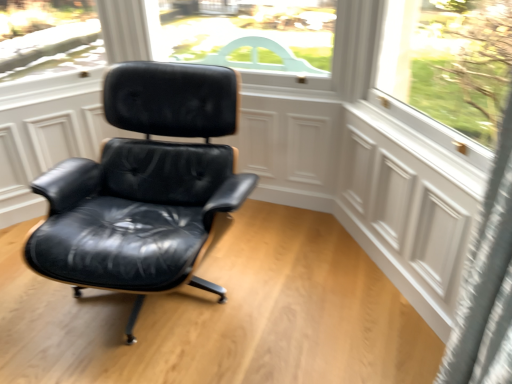
Measure the distance between white matte screen door at right and camera.

They are 1.29 meters apart.

In order to face white matte screen door at right, should I rotate leftwards or rightwards?

To align with it, rotate right about 18.075°.

The image size is (512, 384). I want to click on white matte screen door at right, so click(x=410, y=200).

The height and width of the screenshot is (384, 512). What do you see at coordinates (410, 200) in the screenshot?
I see `white matte screen door at right` at bounding box center [410, 200].

What do you see at coordinates (145, 186) in the screenshot? Image resolution: width=512 pixels, height=384 pixels. I see `black leather chair at center` at bounding box center [145, 186].

Identify the location of black leather chair at center. (145, 186).

Where is `white matte screen door at right`? The image size is (512, 384). white matte screen door at right is located at coordinates (410, 200).

Is white matte screen door at right to the left of black leather chair at center from the viewer's perspective?

In fact, white matte screen door at right is to the right of black leather chair at center.

Is white matte screen door at right in front of or behind black leather chair at center in the image?

white matte screen door at right is positioned farther from the viewer than black leather chair at center.

Which is more distant, [421,139] or [110,260]?

Point [421,139]

From the image's perspective, is white matte screen door at right above or below black leather chair at center?

white matte screen door at right is situated lower than black leather chair at center in the image.

From a real-world perspective, is white matte screen door at right positioned under black leather chair at center based on gravity?

Correct, in the physical world, white matte screen door at right is lower than black leather chair at center.

Considering the relative sizes of white matte screen door at right and black leather chair at center in the image provided, is white matte screen door at right wider than black leather chair at center?

No.

In terms of height, does white matte screen door at right look taller or shorter compared to black leather chair at center?

white matte screen door at right is shorter than black leather chair at center.

Who is smaller, white matte screen door at right or black leather chair at center?

white matte screen door at right is smaller.

Is white matte screen door at right surrounding black leather chair at center?

That's incorrect, black leather chair at center is not inside white matte screen door at right.

Would you say white matte screen door at right is a long distance from black leather chair at center?

That's not correct — white matte screen door at right is a little close to black leather chair at center.

Does white matte screen door at right turn towards black leather chair at center?

Yes, white matte screen door at right is aimed at black leather chair at center.

This screenshot has width=512, height=384. I want to click on screen door located underneath the black leather chair at center (from a real-world perspective), so click(410, 200).

Considering the positions of objects black leather chair at center and white matte screen door at right in the image provided, who is more to the left, black leather chair at center or white matte screen door at right?

black leather chair at center is more to the left.

In the scene shown: Is black leather chair at center further to the viewer compared to white matte screen door at right?

No, black leather chair at center is closer to the camera.

Does point (213, 67) appear closer or farther from the camera than point (395, 120)?

Point (213, 67) is positioned farther from the camera compared to point (395, 120).

From the image's perspective, is black leather chair at center beneath white matte screen door at right?

Actually, black leather chair at center appears above white matte screen door at right in the image.

From a real-world perspective, is black leather chair at center on white matte screen door at right?

Yes.

Which of these two, black leather chair at center or white matte screen door at right, is wider?

With larger width is black leather chair at center.

Considering the sizes of black leather chair at center and white matte screen door at right in the image, is black leather chair at center taller or shorter than white matte screen door at right?

Considering their sizes, black leather chair at center has more height than white matte screen door at right.

Which of these two, black leather chair at center or white matte screen door at right, is bigger?

black leather chair at center is bigger.

Can white matte screen door at right be found inside black leather chair at center?

Definitely not — white matte screen door at right is not inside black leather chair at center.

Is there a large distance between black leather chair at center and white matte screen door at right?

Actually, black leather chair at center and white matte screen door at right are a little close together.

Could you tell me if black leather chair at center is facing white matte screen door at right?

No, black leather chair at center is not aimed at white matte screen door at right.

How many degrees apart are the facing directions of black leather chair at center and white matte screen door at right?

There is a 59.8-degree angle between the facing directions of black leather chair at center and white matte screen door at right.

Find the location of a particular element. screen door to the right of black leather chair at center is located at coordinates (410, 200).

You are a GUI agent. You are given a task and a screenshot of the screen. Output one action in this format:
    pyautogui.click(x=<x>, y=<y>)
    Task: Click on the chair above the white matte screen door at right (from a real-world perspective)
    The image size is (512, 384).
    Given the screenshot: What is the action you would take?
    pyautogui.click(x=145, y=186)

Where is `chair in front of the white matte screen door at right`? chair in front of the white matte screen door at right is located at coordinates (145, 186).